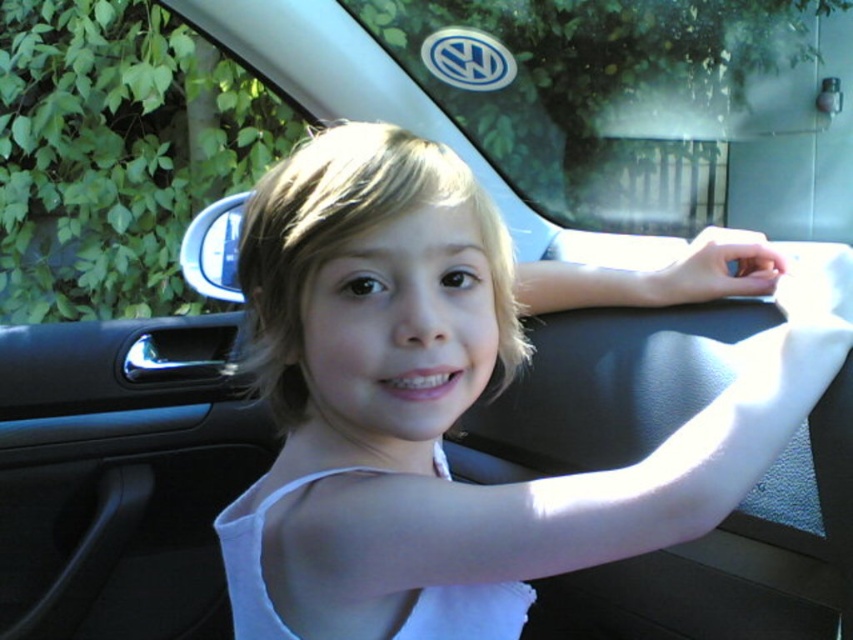
Can you confirm if white fabric at center is wider than transparent glass window at upper left?

No.

Which is below, white fabric at center or transparent glass window at upper left?

Positioned lower is white fabric at center.

Who is more forward, (561, 532) or (128, 140)?

Point (561, 532)

This screenshot has width=853, height=640. I want to click on white fabric at center, so click(462, 400).